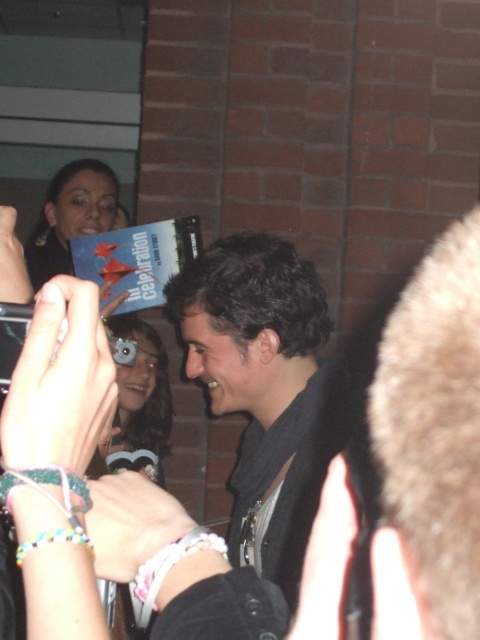
Is matte black book at upper left to the left of matte black camera at center from the viewer's perspective?

Indeed, matte black book at upper left is positioned on the left side of matte black camera at center.

The image size is (480, 640). I want to click on matte black book at upper left, so (71, 216).

Where is `matte black book at upper left`? The width and height of the screenshot is (480, 640). matte black book at upper left is located at coordinates (71, 216).

Based on the photo, which is more to the right, dark brown hair at center or matte black book at upper left?

Positioned to the right is dark brown hair at center.

Which is below, dark brown hair at center or matte black book at upper left?

dark brown hair at center is below.

The image size is (480, 640). What do you see at coordinates (265, 388) in the screenshot?
I see `dark brown hair at center` at bounding box center [265, 388].

You are a GUI agent. You are given a task and a screenshot of the screen. Output one action in this format:
    pyautogui.click(x=<x>, y=<y>)
    Task: Click on the dark brown hair at center
    The height and width of the screenshot is (640, 480).
    Given the screenshot: What is the action you would take?
    pyautogui.click(x=265, y=388)

In the scene shown: Is dark brown hair at center taller than matte black camera at center?

Correct, dark brown hair at center is much taller as matte black camera at center.

Does dark brown hair at center have a larger size compared to matte black camera at center?

Indeed, dark brown hair at center has a larger size compared to matte black camera at center.

Is point (264, 236) positioned before point (145, 388)?

Yes.

The width and height of the screenshot is (480, 640). I want to click on dark brown hair at center, so click(265, 388).